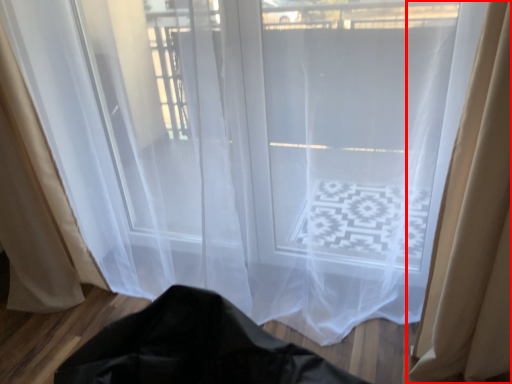
Question: Considering the relative positions of curtain (annotated by the red box) and curtain in the image provided, where is curtain (annotated by the red box) located with respect to the staircase?

Choices:
 (A) left
 (B) right

Answer: (B)